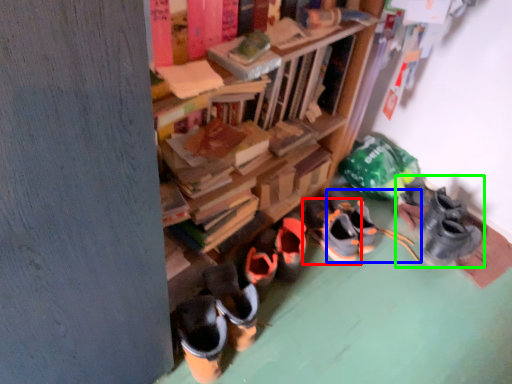
Question: Considering the real-world distances, which object is closest to footwear (highlighted by a red box)? footwear (highlighted by a blue box) or footwear (highlighted by a green box).

Choices:
 (A) footwear
 (B) footwear

Answer: (A)